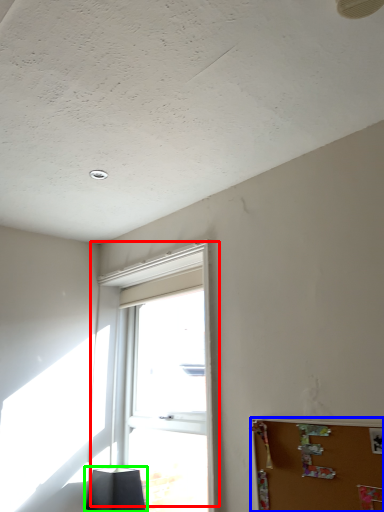
Question: Which is nearer to the window (highlighted by a red box)? bulletin board (highlighted by a blue box) or lamp (highlighted by a green box).

Choices:
 (A) bulletin board
 (B) lamp

Answer: (B)